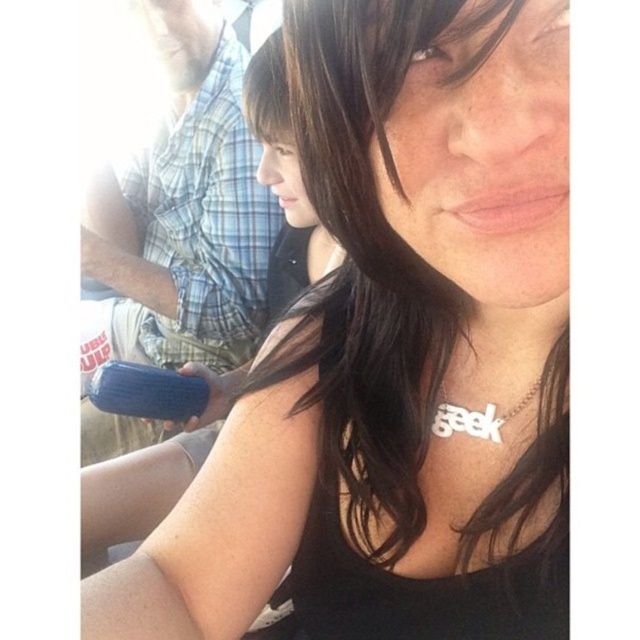
This screenshot has height=640, width=640. Describe the element at coordinates (177, 225) in the screenshot. I see `blue rubber object at center` at that location.

The height and width of the screenshot is (640, 640). Identify the location of blue rubber object at center. (177, 225).

Which is in front, point (150, 156) or point (445, 410)?

Point (445, 410)

The image size is (640, 640). What are the coordinates of `blue rubber object at center` in the screenshot? It's located at (177, 225).